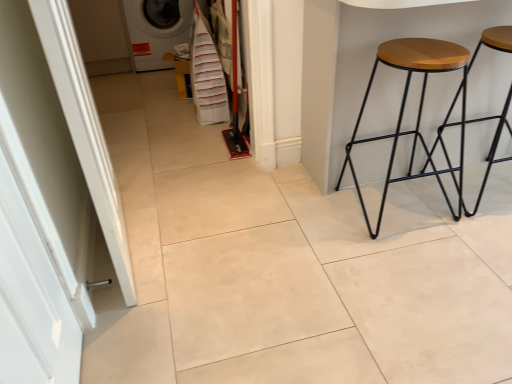
This screenshot has width=512, height=384. What are the coordinates of `vacant space that is in between white glossy door at left and wooden seat stool at right, which ranks as the 1th stool in right-to-left order` in the screenshot? It's located at (304, 290).